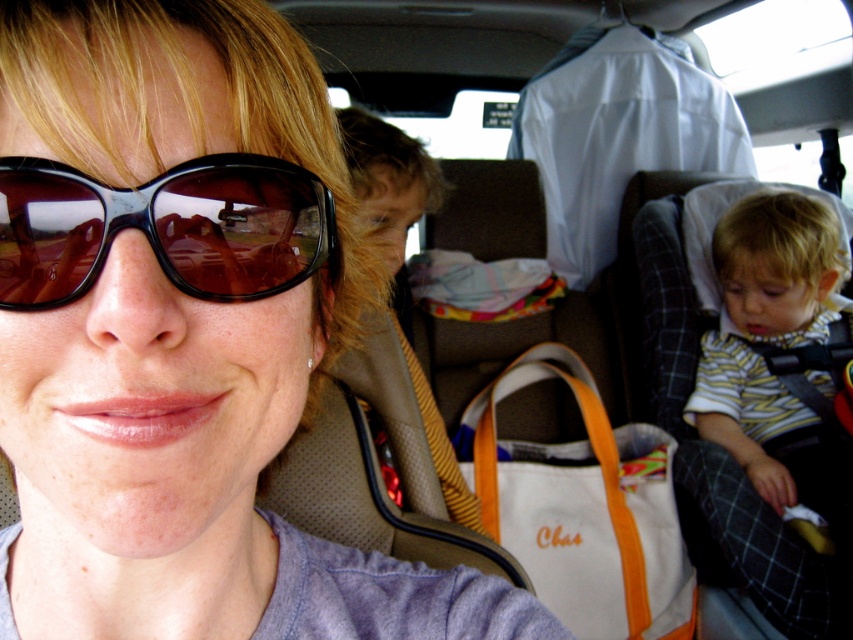
Can you confirm if striped cotton shirt at right is thinner than white fabric bag at center?

Yes.

Which is below, striped cotton shirt at right or white fabric bag at center?

striped cotton shirt at right

Locate an element on the screen. striped cotton shirt at right is located at coordinates (776, 348).

Can you confirm if black glossy sunglasses at center is smaller than white fabric bag at center?

Correct, black glossy sunglasses at center occupies less space than white fabric bag at center.

Which is more to the right, black glossy sunglasses at center or white fabric bag at center?

Positioned to the right is white fabric bag at center.

Image resolution: width=853 pixels, height=640 pixels. I want to click on black glossy sunglasses at center, so click(x=163, y=227).

Can you confirm if black glossy sunglasses at center is positioned to the left of striped cotton shirt at right?

Yes, black glossy sunglasses at center is to the left of striped cotton shirt at right.

Which is behind, point (279, 228) or point (788, 420)?

Positioned behind is point (788, 420).

Is point (202, 280) more distant than point (808, 481)?

No, it is not.

Where is `black glossy sunglasses at center`? The image size is (853, 640). black glossy sunglasses at center is located at coordinates (163, 227).